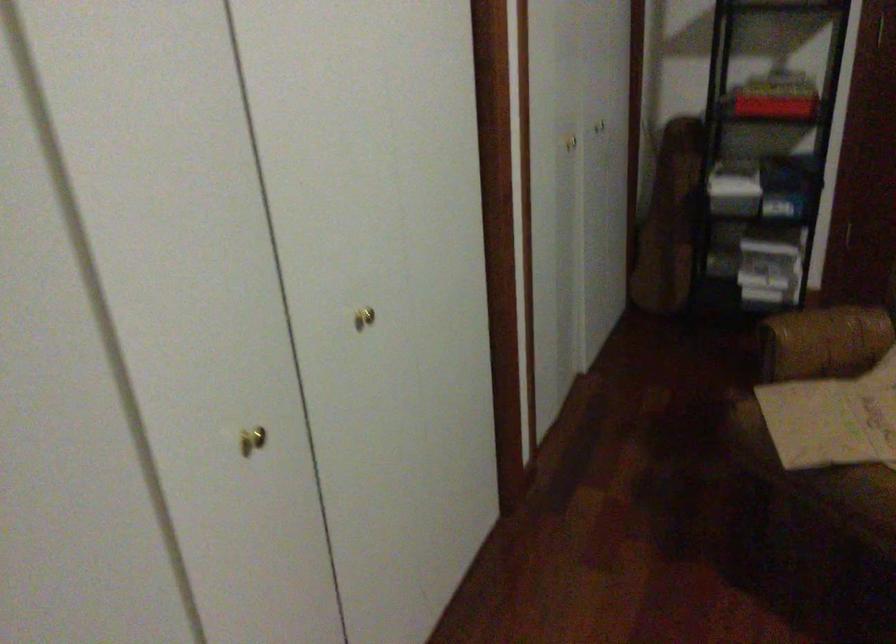
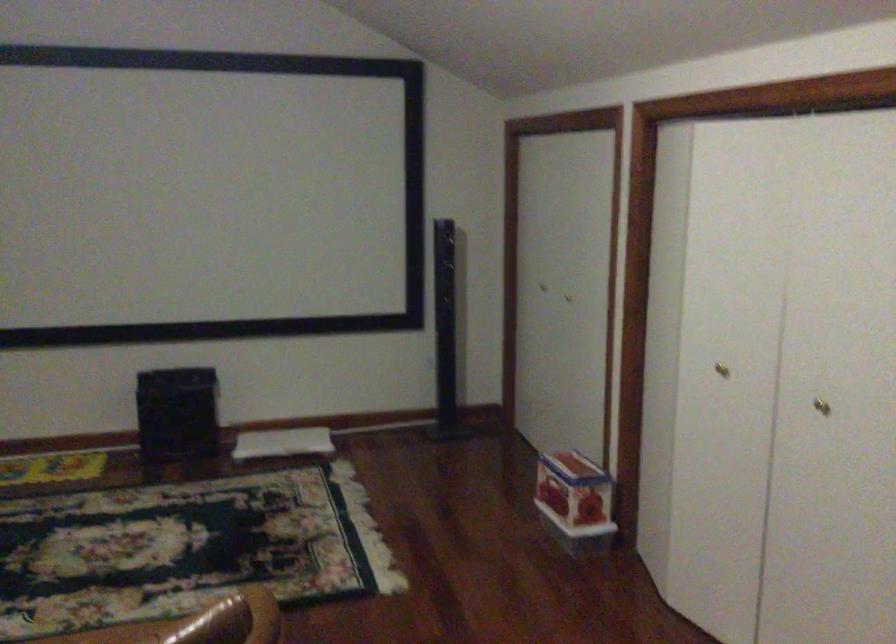
Find the pixel in the second image that matches the point at 371,317 in the first image.

(821, 406)